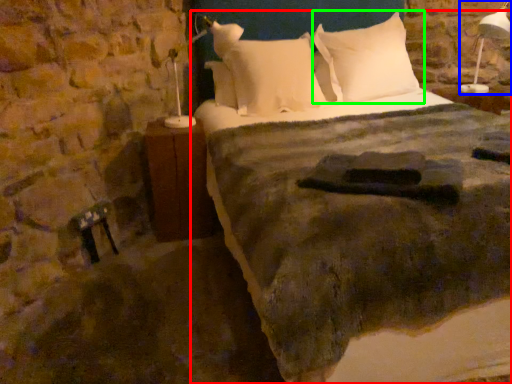
Question: Estimate the real-world distances between objects in this image. Which object is closer to bed (highlighted by a red box), bedside lamp (highlighted by a blue box) or pillow (highlighted by a green box)?

Choices:
 (A) bedside lamp
 (B) pillow

Answer: (B)